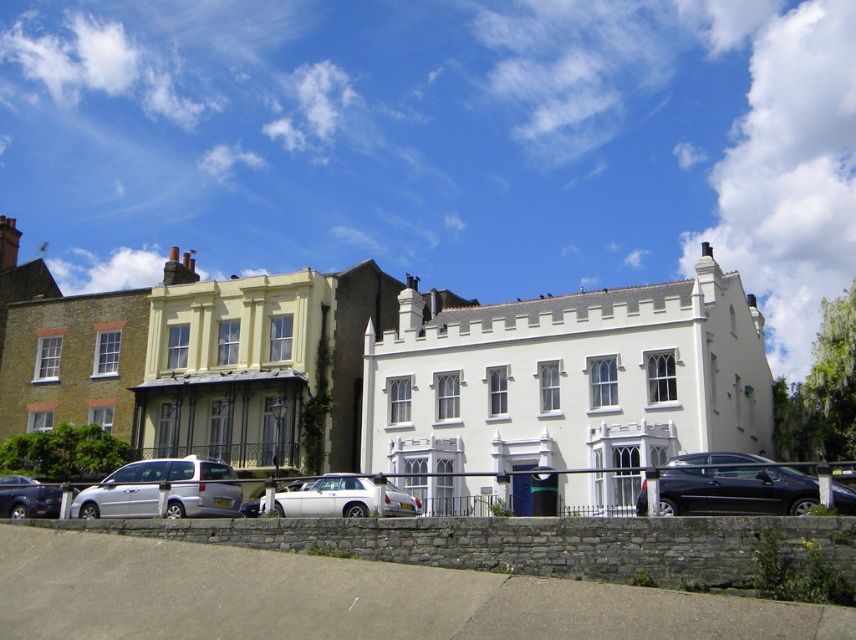
You are a delivery driver who needs to park your vehicle in a tight space near the buildings. You have a silver metallic van at lower left and a white glossy sedan at center. Which vehicle would be easier to maneuver in this tight space?

The silver metallic van at lower left has a smaller size compared to the white glossy sedan at center, so it would be easier to maneuver in tight spaces due to its smaller size.